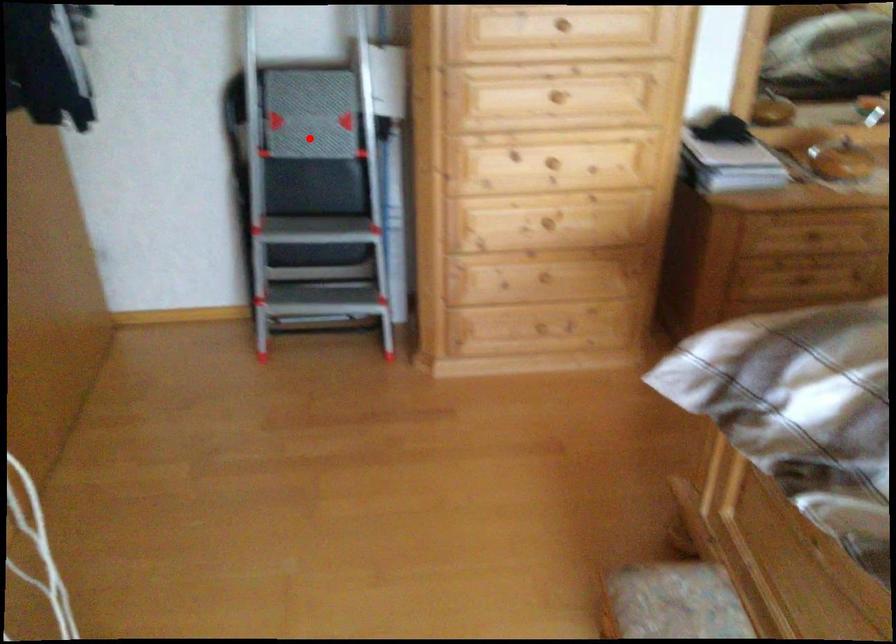
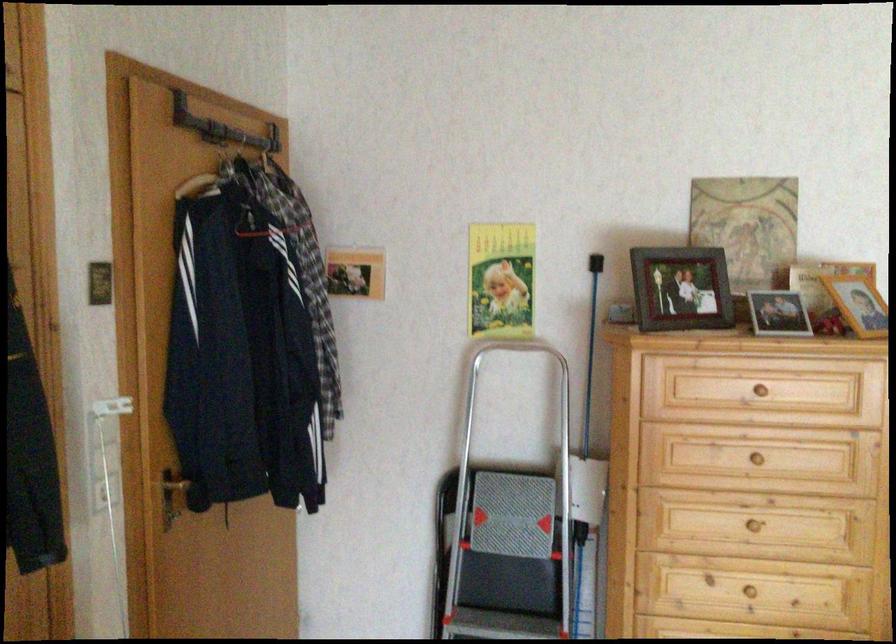
Where in the second image is the point corresponding to the highlighted location from the first image?

(510, 536)